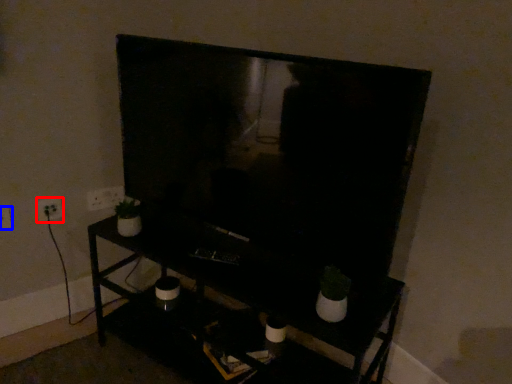
Question: Which of the following is the closest to the observer, electric outlet (highlighted by a red box) or electric outlet (highlighted by a blue box)?

Choices:
 (A) electric outlet
 (B) electric outlet

Answer: (B)